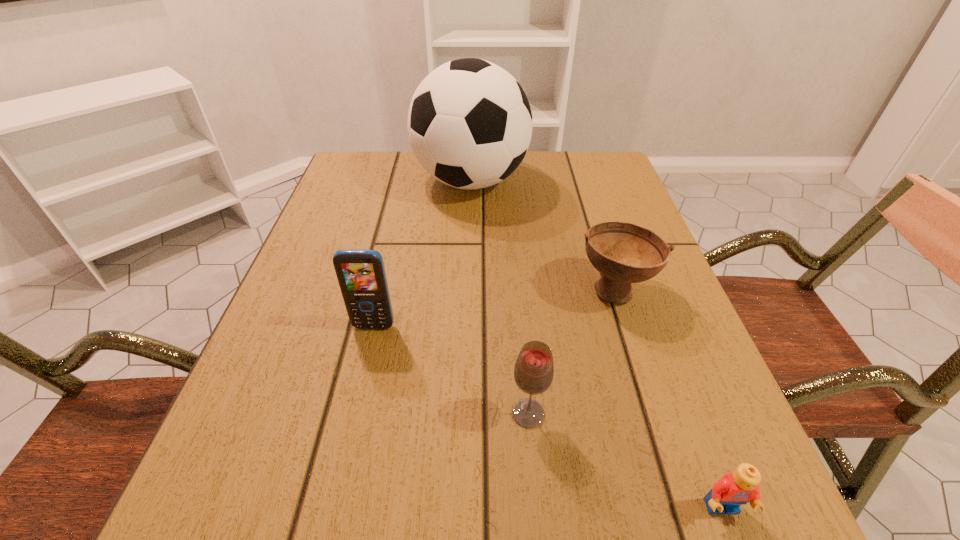
I want to click on vacant space positioned on the back of the glass drink container, so click(519, 315).

Locate an element on the screen. vacant region located on the back of the soup bowl is located at coordinates (583, 188).

This screenshot has width=960, height=540. I want to click on object at the far edge, so click(x=470, y=123).

Where is `object located at the near edge`? object located at the near edge is located at coordinates (734, 489).

The width and height of the screenshot is (960, 540). I want to click on object that is at the left edge, so click(x=361, y=275).

Locate an element on the screen. The height and width of the screenshot is (540, 960). soup bowl present at the right edge is located at coordinates (624, 253).

Where is `Lego at the right edge`? Image resolution: width=960 pixels, height=540 pixels. Lego at the right edge is located at coordinates (734, 489).

Where is `object that is at the near right corner`? Image resolution: width=960 pixels, height=540 pixels. object that is at the near right corner is located at coordinates (734, 489).

This screenshot has height=540, width=960. In order to click on vacant space at the far edge of the desktop in this screenshot , I will do `click(562, 186)`.

Where is `free space at the left edge of the desktop`? free space at the left edge of the desktop is located at coordinates (326, 306).